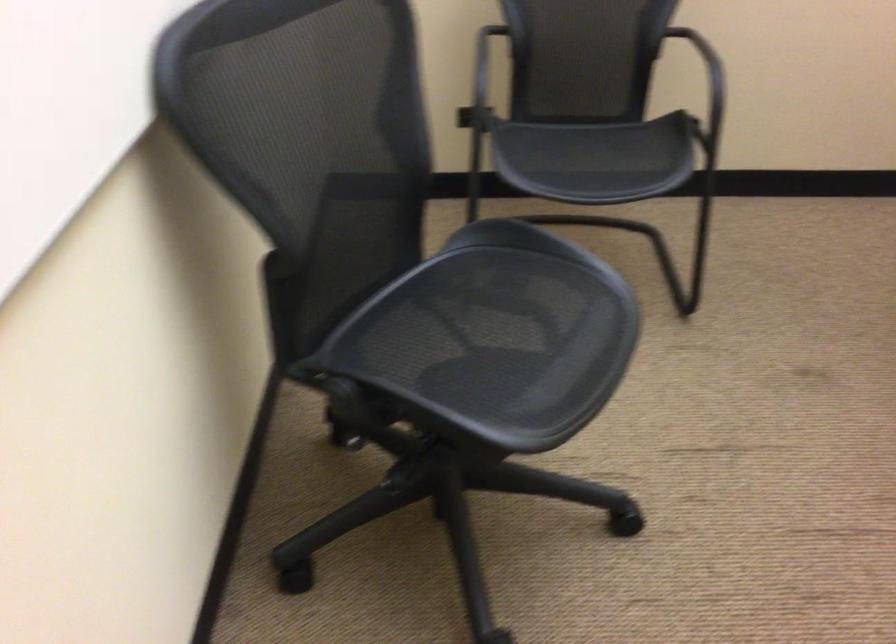
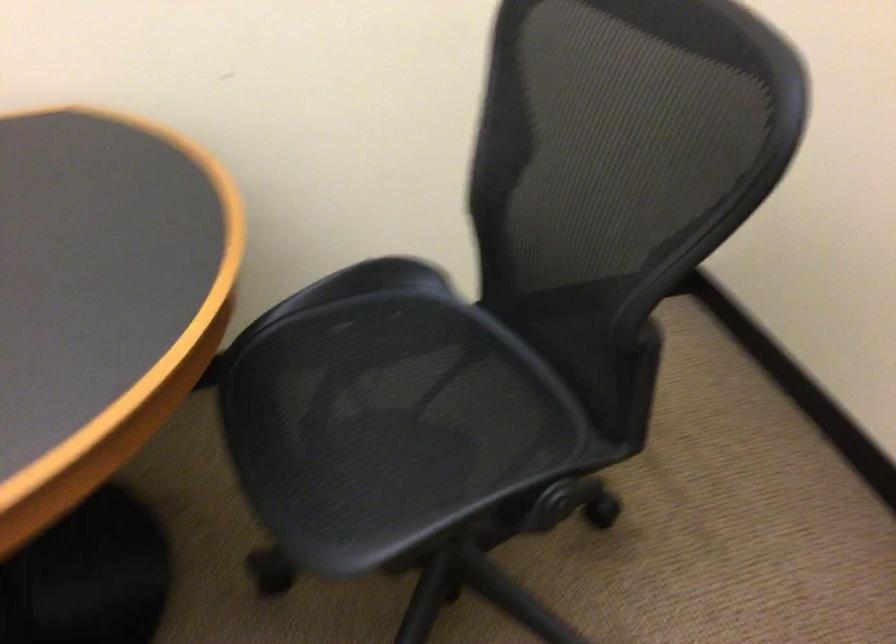
How did the camera likely rotate?

The camera rotated toward right-down.